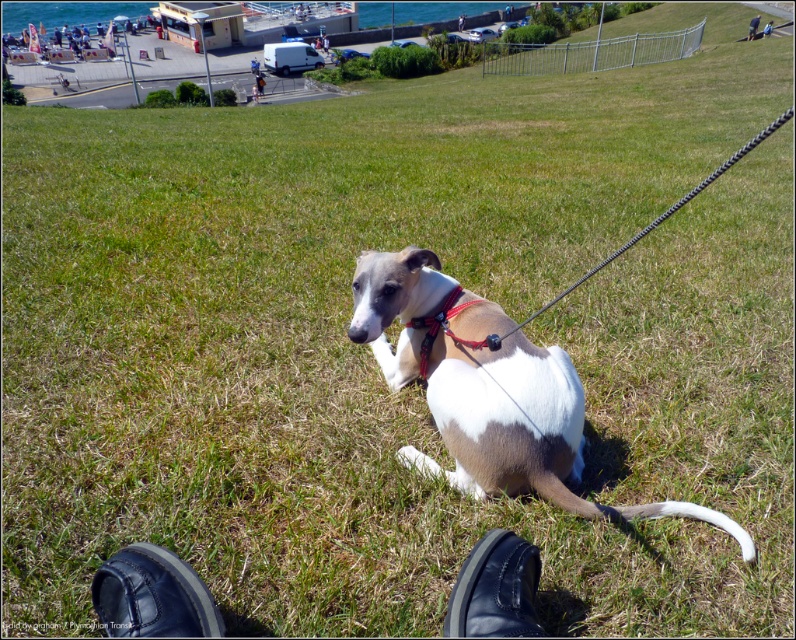
Question: Does black leather shoe at lower center have a smaller size compared to red nylon collar at center?

Choices:
 (A) no
 (B) yes

Answer: (B)

Question: Which point is closer to the camera?

Choices:
 (A) black leather shoe at lower center
 (B) black leather shoe at lower left
 (C) red nylon collar at center
 (D) brown and white fur at center

Answer: (B)

Question: Considering the real-world distances, which object is closest to the black leather shoe at lower center?

Choices:
 (A) black leather shoe at lower left
 (B) red nylon collar at center

Answer: (A)

Question: Which object is closer to the camera taking this photo?

Choices:
 (A) red nylon collar at center
 (B) brown and white fur at center
 (C) black leather shoe at lower left

Answer: (C)

Question: In this image, where is black leather shoe at lower left located relative to black leather shoe at lower center?

Choices:
 (A) right
 (B) left

Answer: (B)

Question: Does brown and white fur at center have a larger size compared to black leather shoe at lower left?

Choices:
 (A) no
 (B) yes

Answer: (B)